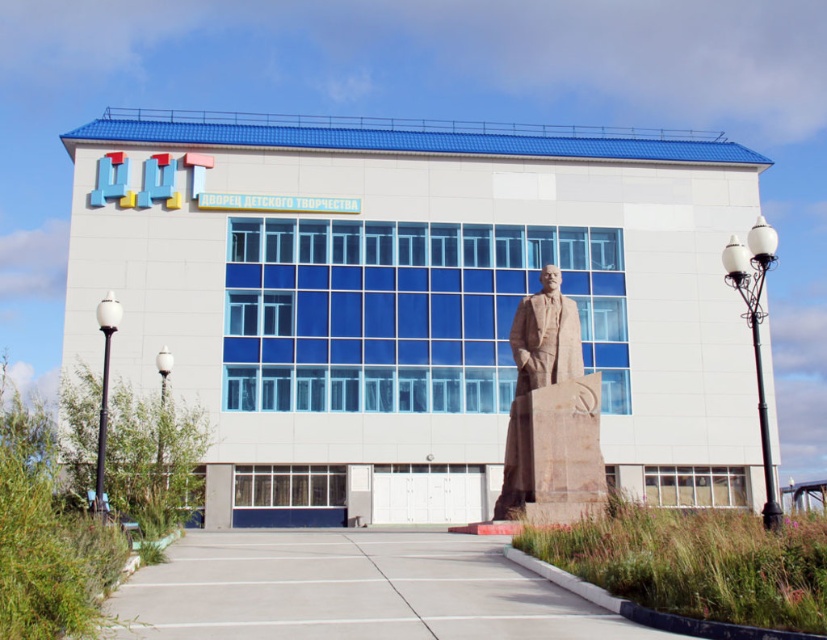
Who is positioned more to the left, polished stone statue at center or black wrought iron streetlight at right?

Answer: From the viewer's perspective, polished stone statue at center appears more on the left side.

Is polished stone statue at center behind black wrought iron streetlight at right?

Yes.

Between point (295, 241) and point (759, 323), which one is positioned in front?

Point (759, 323) is in front.

Where is `polished stone statue at center`? polished stone statue at center is located at coordinates (414, 294).

Describe the element at coordinates (541, 385) in the screenshot. The width and height of the screenshot is (827, 640). I see `brown stone statue at center` at that location.

Is point (509, 332) less distant than point (103, 298)?

Yes.

Locate an element on the screen. This screenshot has height=640, width=827. brown stone statue at center is located at coordinates (541, 385).

Image resolution: width=827 pixels, height=640 pixels. Find the location of `black wrought iron streetlight at right`. black wrought iron streetlight at right is located at coordinates (754, 332).

Does black wrought iron streetlight at right appear over white glossy lamp post at left?

No.

The height and width of the screenshot is (640, 827). In order to click on black wrought iron streetlight at right in this screenshot , I will do `click(754, 332)`.

Locate an element on the screen. black wrought iron streetlight at right is located at coordinates (754, 332).